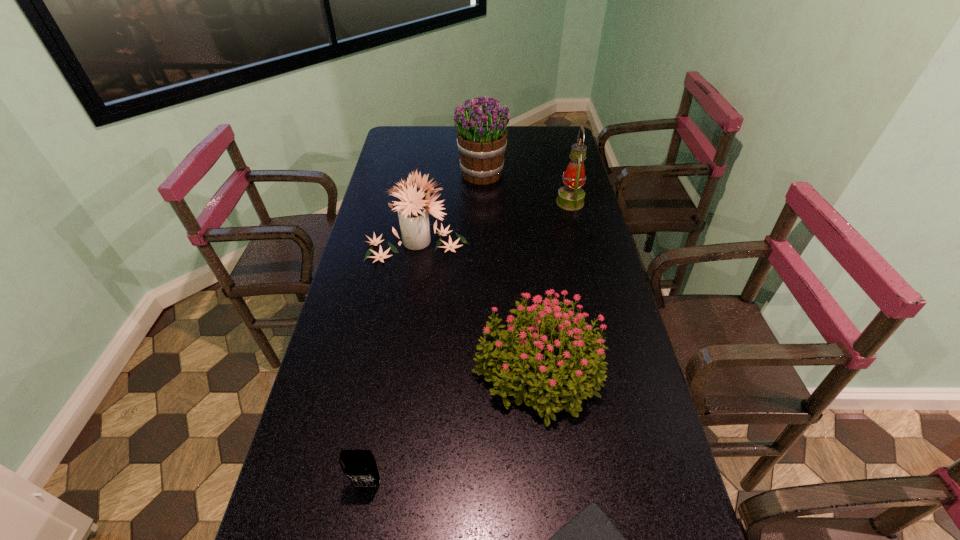
Image resolution: width=960 pixels, height=540 pixels. I want to click on free space located 0.090m on the left of the nearest bouquet, so click(x=437, y=368).

Identify the location of free space located 0.070m on the screen of the cellular telephone. This screenshot has width=960, height=540. (360, 528).

Locate an element on the screen. The height and width of the screenshot is (540, 960). bouquet present at the left edge is located at coordinates (413, 210).

Locate an element on the screen. This screenshot has width=960, height=540. cellular telephone present at the left edge is located at coordinates (359, 466).

What are the coordinates of `oil lamp situated at the right edge` in the screenshot? It's located at (571, 197).

Identify the location of bouquet that is at the right edge. This screenshot has width=960, height=540. coord(579,365).

In order to click on free space at the far edge of the desktop in this screenshot , I will do `click(527, 148)`.

In the image, there is a desktop. Identify the location of vacant space at the left edge. The image size is (960, 540). (320, 485).

Find the location of a particular element. vacant space at the right edge of the desktop is located at coordinates (565, 168).

In the image, there is a desktop. Where is `vacant space at the far left corner`? This screenshot has height=540, width=960. vacant space at the far left corner is located at coordinates (420, 132).